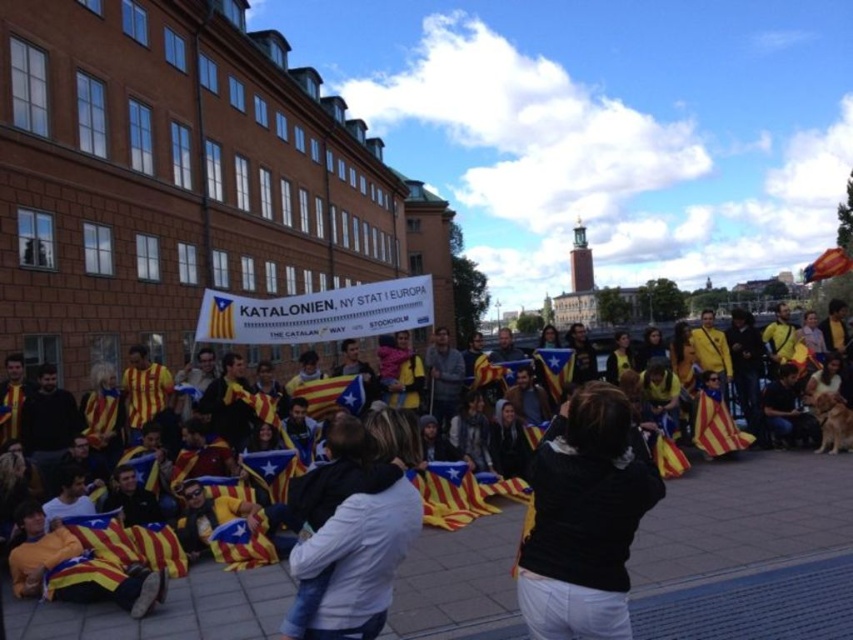
You are a photographer standing at the center of the paved area where the group is gathered. You want to take a photo of the yellow fabric flag at center so that it appears centered in your viewfinder. Given the flag is located at coordinates 0.859 on the x and 0.877 on the y axis, would you need to adjust your camera position or angle to center it? Explain why or why not.

The yellow fabric flag at center is already positioned at coordinates 0.859 on the x and 0.877 on the y axis. Since the flag is labeled as being at the center, its coordinates should align with the viewfinder center. Therefore, no adjustment is needed unless the photographer is not at the exact central point of the paved area.

You are a drone operator trying to capture aerial footage of the protest. You have two points marked on your screen for focus. The first point is at coordinate point (x=242, y=602) and the second point is at coordinate point (x=331, y=566). Based on the scene, which point should you focus on first to ensure the drone captures the protesters holding Catalan flags in the foreground?

Point (x=331, y=566) should be focused on first because it is in front of point (x=242, y=602), which is behind it. Focusing on the closer point ensures the protesters holding Catalan flags in the foreground are captured clearly.

You are a photographer standing in the crowd at the protest. You want to take a photo that includes both the point at coordinates point (566, 576) and the point at coordinates point (369, 465). Which point should you focus on first to ensure both are in sharp focus?

You should focus on point (566, 576) first because it is closer to the camera, ensuring that both points will be in focus when using a suitable aperture.